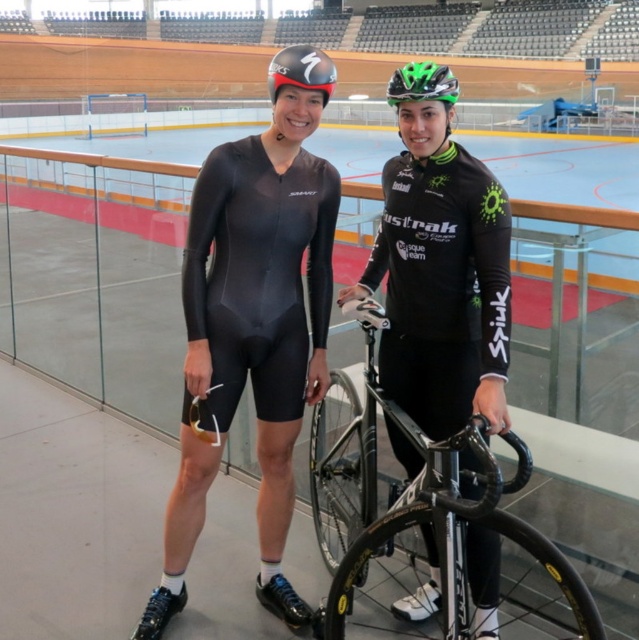
What do you see at coordinates (420, 508) in the screenshot? I see `shiny black frame at center` at bounding box center [420, 508].

Does point (459, 474) come closer to viewer compared to point (404, 70)?

Yes.

The width and height of the screenshot is (639, 640). In order to click on shiny black frame at center in this screenshot , I will do `click(420, 508)`.

Which is above, black matte cycling suit at center or matte black helmet at upper center?

Positioned higher is matte black helmet at upper center.

From the picture: Who is more forward, (447,250) or (320,58)?

Point (320,58) is in front.

Find the location of a particular element. This screenshot has height=640, width=639. black matte cycling suit at center is located at coordinates (442, 278).

Can you confirm if black matte suit at center is positioned below green matte helmet at upper center?

Yes.

Can you confirm if black matte suit at center is positioned above green matte helmet at upper center?

No, black matte suit at center is not above green matte helmet at upper center.

Describe the element at coordinates (250, 336) in the screenshot. I see `black matte suit at center` at that location.

The height and width of the screenshot is (640, 639). I want to click on black matte suit at center, so point(250,336).